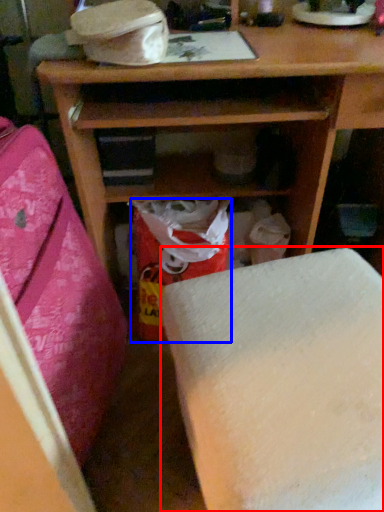
Question: Which object appears farthest to the camera in this image, furniture (highlighted by a red box) or shopping bag (highlighted by a blue box)?

Choices:
 (A) furniture
 (B) shopping bag

Answer: (B)